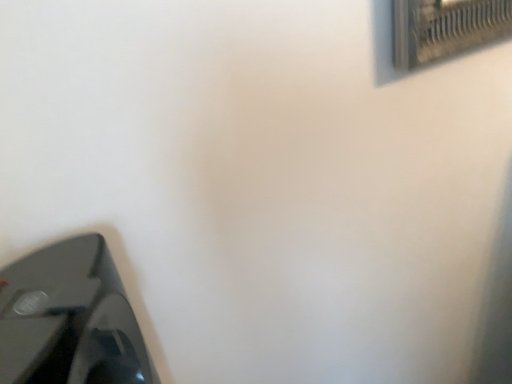
Image resolution: width=512 pixels, height=384 pixels. Describe the element at coordinates (70, 319) in the screenshot. I see `black plastic remote at lower left` at that location.

At what (x,y) coordinates should I click in order to perform the action: click on black plastic remote at lower left. Please return your answer as a coordinate pair (x, y). The image size is (512, 384). Looking at the image, I should click on (70, 319).

Identify the location of black plastic remote at lower left. The height and width of the screenshot is (384, 512). (70, 319).